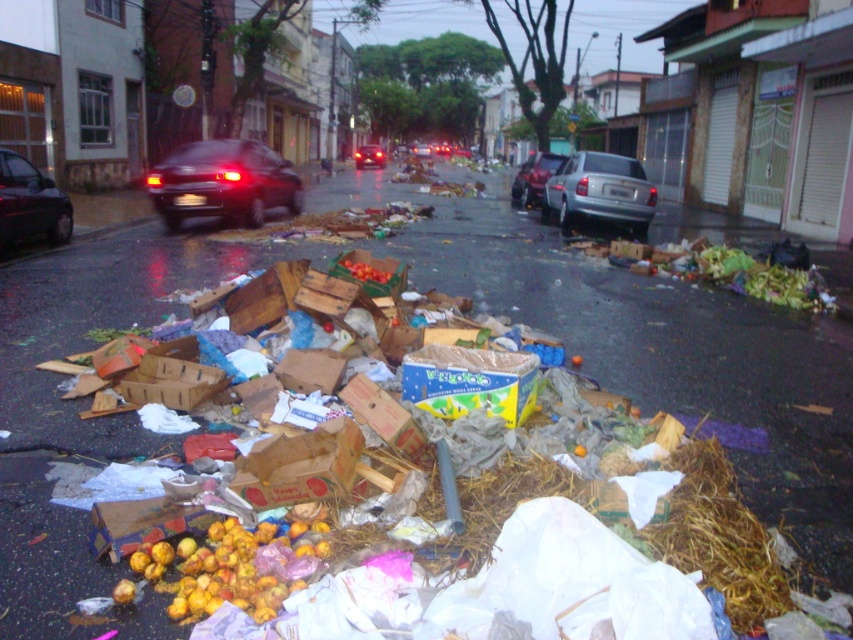
Question: Which of these objects is positioned farthest from the shiny black car at left?

Choices:
 (A) glossy black car at left
 (B) brown cardboard box at center
 (C) shiny black sedan at center

Answer: (C)

Question: Observing the image, what is the correct spatial positioning of yellow matte fruit at lower left in reference to glossy black car at left?

Choices:
 (A) above
 (B) below

Answer: (B)

Question: Considering the real-world distances, which object is farthest from the red matte tomatoes at center?

Choices:
 (A) shiny black car at left
 (B) metallic silver car at center
 (C) shiny black sedan at center
 (D) brown cardboard box at center

Answer: (C)

Question: Considering the relative positions of shiny black car at left and metallic silver car at center in the image provided, where is shiny black car at left located with respect to metallic silver car at center?

Choices:
 (A) right
 (B) left

Answer: (B)

Question: Which point is farther from the camera taking this photo?

Choices:
 (A) (357, 273)
 (B) (369, 154)
 (C) (430, 376)
 (D) (258, 198)

Answer: (B)

Question: Can you confirm if yellow matte fruit at lower left is bigger than shiny black car at left?

Choices:
 (A) no
 (B) yes

Answer: (A)